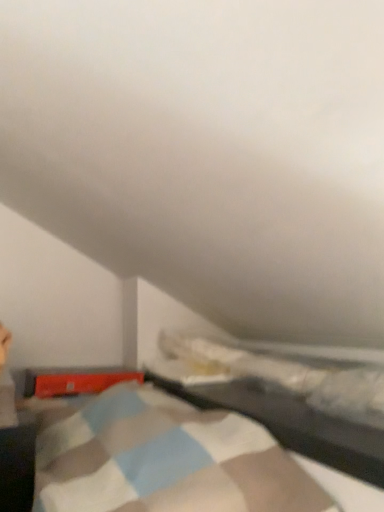
Image resolution: width=384 pixels, height=512 pixels. What do you see at coordinates (283, 395) in the screenshot?
I see `soft fabric bed at center` at bounding box center [283, 395].

What is the approximate height of soft fabric bed at center?

2.95 inches.

This screenshot has width=384, height=512. I want to click on soft fabric bed at center, so click(x=283, y=395).

You are a GUI agent. You are given a task and a screenshot of the screen. Output one action in this format:
    pyautogui.click(x=<x>, y=<y>)
    Task: Click on the soft fabric bed at center
    Image resolution: width=384 pixels, height=512 pixels.
    Given the screenshot: What is the action you would take?
    pyautogui.click(x=283, y=395)